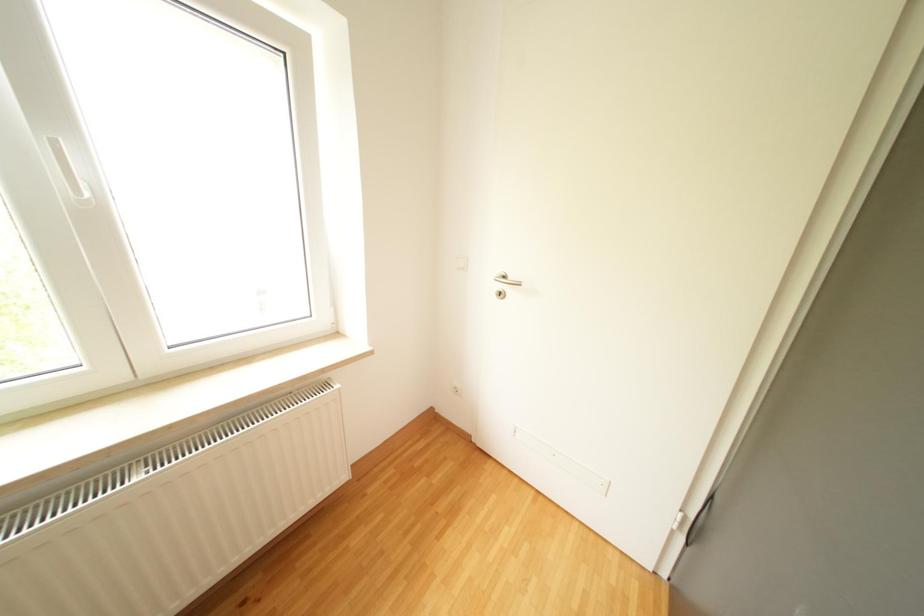
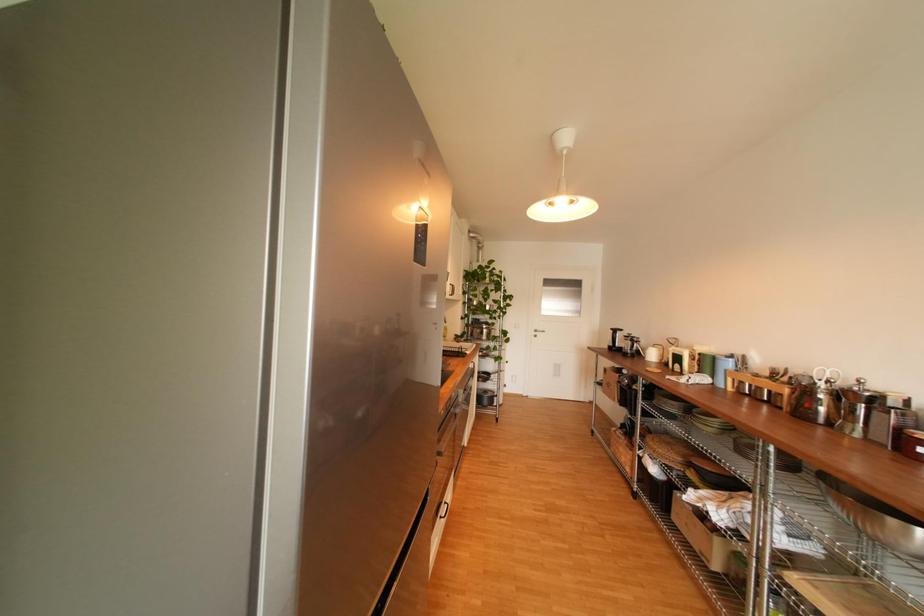
Question: Based on the continuous images, in which direction is the camera rotating? Reply with the corresponding letter.

Choices:
 (A) Left
 (B) Right
 (C) Up
 (D) Down

Answer: (B)